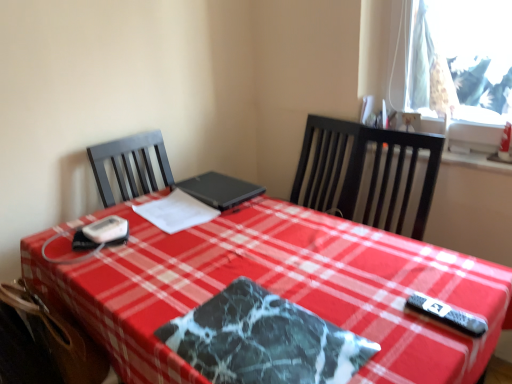
Question: Considering the relative sizes of black matte laptop at center and white paper at center in the image provided, is black matte laptop at center shorter than white paper at center?

Choices:
 (A) yes
 (B) no

Answer: (B)

Question: Considering the relative sizes of black matte laptop at center and white paper at center in the image provided, is black matte laptop at center bigger than white paper at center?

Choices:
 (A) no
 (B) yes

Answer: (B)

Question: Are black matte laptop at center and white paper at center located far from each other?

Choices:
 (A) no
 (B) yes

Answer: (A)

Question: Is black matte laptop at center thinner than white paper at center?

Choices:
 (A) no
 (B) yes

Answer: (A)

Question: From a real-world perspective, is black matte laptop at center on white paper at center?

Choices:
 (A) yes
 (B) no

Answer: (A)

Question: Is marble-patterned placemat at center taller or shorter than white paper at center?

Choices:
 (A) short
 (B) tall

Answer: (A)

Question: Is marble-patterned placemat at center situated inside white paper at center or outside?

Choices:
 (A) inside
 (B) outside

Answer: (B)

Question: From a real-world perspective, relative to white paper at center, is marble-patterned placemat at center vertically above or below?

Choices:
 (A) above
 (B) below

Answer: (B)

Question: Looking at their shapes, would you say marble-patterned placemat at center is wider or thinner than white paper at center?

Choices:
 (A) wide
 (B) thin

Answer: (B)

Question: Considering the positions of brown leather swivel chair at lower left and marble-patterned placemat at center in the image, is brown leather swivel chair at lower left taller or shorter than marble-patterned placemat at center?

Choices:
 (A) short
 (B) tall

Answer: (B)

Question: In the image, is brown leather swivel chair at lower left on the left side or the right side of marble-patterned placemat at center?

Choices:
 (A) right
 (B) left

Answer: (B)

Question: Considering the positions of brown leather swivel chair at lower left and marble-patterned placemat at center in the image, is brown leather swivel chair at lower left bigger or smaller than marble-patterned placemat at center?

Choices:
 (A) small
 (B) big

Answer: (B)

Question: Is point (91, 352) closer or farther from the camera than point (296, 347)?

Choices:
 (A) farther
 (B) closer

Answer: (A)

Question: Considering the positions of marble-patterned placemat at center and brown leather swivel chair at lower left in the image, is marble-patterned placemat at center wider or thinner than brown leather swivel chair at lower left?

Choices:
 (A) thin
 (B) wide

Answer: (B)

Question: In terms of height, does marble-patterned placemat at center look taller or shorter compared to brown leather swivel chair at lower left?

Choices:
 (A) short
 (B) tall

Answer: (A)